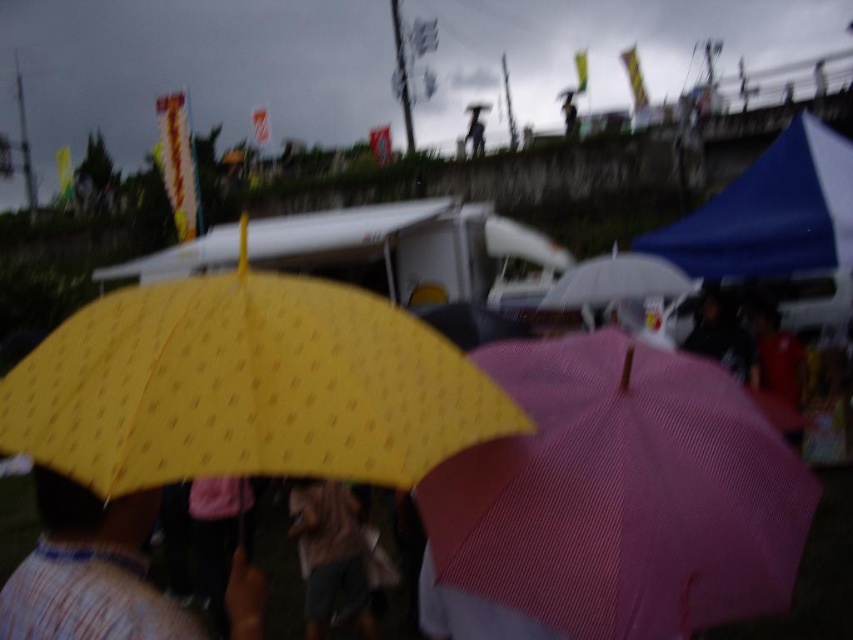
Question: Is yellow matte umbrella at lower left smaller than matte white umbrella at center?

Choices:
 (A) no
 (B) yes

Answer: (B)

Question: Which point appears closest to the camera in this image?

Choices:
 (A) (345, 550)
 (B) (585, 269)
 (C) (151, 365)
 (D) (80, 605)

Answer: (D)

Question: Which point is closer to the camera?

Choices:
 (A) pink fabric umbrella at center
 (B) yellow matte umbrella at lower left
 (C) matte white umbrella at center

Answer: (B)

Question: Which point is closer to the camera?

Choices:
 (A) (698, 284)
 (B) (142, 529)
 (C) (364, 580)

Answer: (B)

Question: Is pink fabric umbrella at center positioned in front of matte white umbrella at center?

Choices:
 (A) no
 (B) yes

Answer: (B)

Question: Does yellow dotted umbrella at center appear over brown fabric umbrella at center?

Choices:
 (A) no
 (B) yes

Answer: (B)